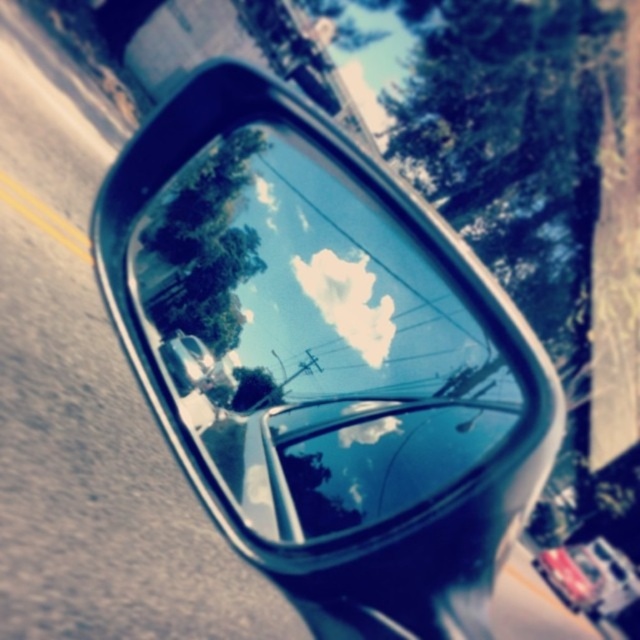
Is point (193, 330) behind point (600, 586)?

That is True.

The width and height of the screenshot is (640, 640). I want to click on glossy metallic side mirror at upper center, so click(x=310, y=339).

Between point (280, 400) and point (536, 566), which one is positioned in front?

Point (536, 566) is in front.

Find the location of a particular element. glossy metallic side mirror at upper center is located at coordinates (310, 339).